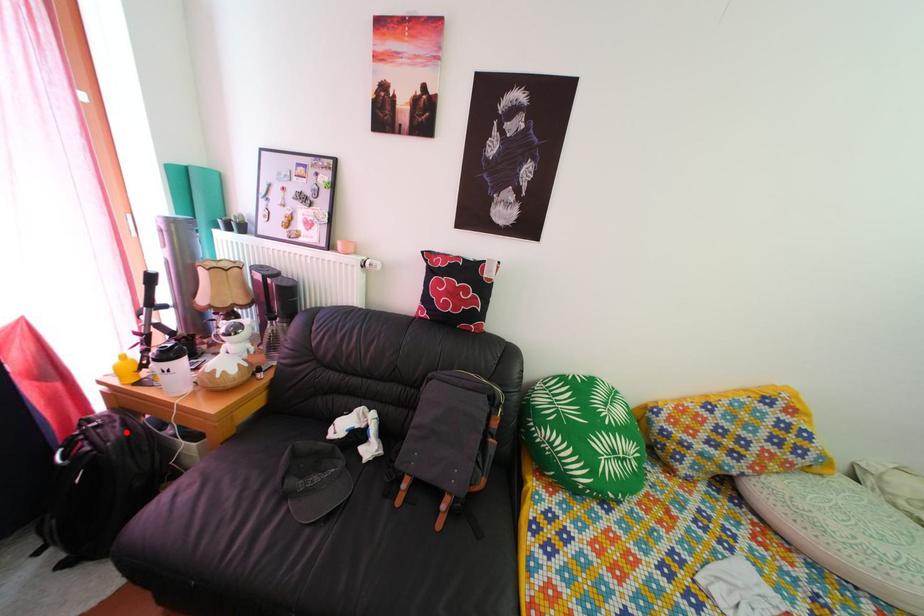
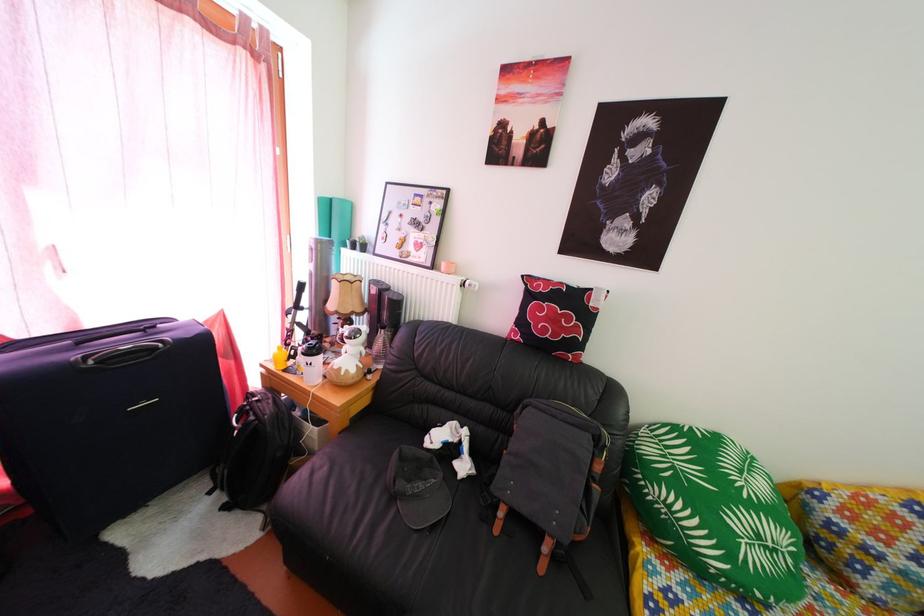
Question: I am providing you with two images of the same scene from different viewpoints. In image1, a red point is highlighted. Considering the same 3D point in image2, which of the following is correct?

Choices:
 (A) It is closer
 (B) It is farther

Answer: (B)